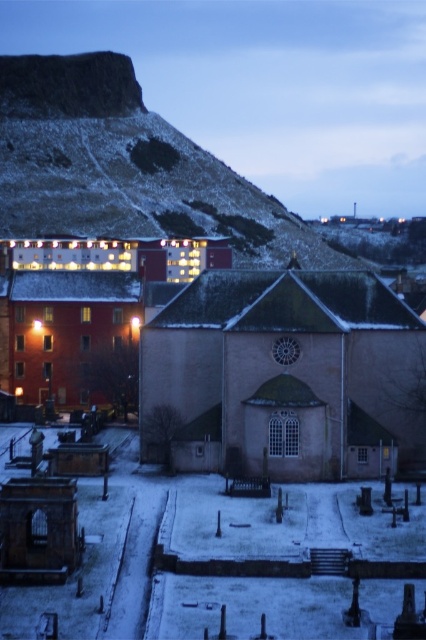
Question: Is smooth stone church at center further to the viewer compared to matte brick church at center?

Choices:
 (A) yes
 (B) no

Answer: (B)

Question: Is smooth stone church at center below matte brick church at center?

Choices:
 (A) no
 (B) yes

Answer: (B)

Question: Is smooth stone church at center below matte brick church at center?

Choices:
 (A) yes
 (B) no

Answer: (A)

Question: Among these objects, which one is nearest to the camera?

Choices:
 (A) smooth stone church at center
 (B) matte brick church at center

Answer: (A)